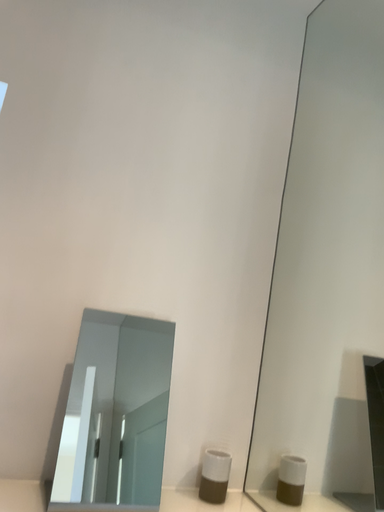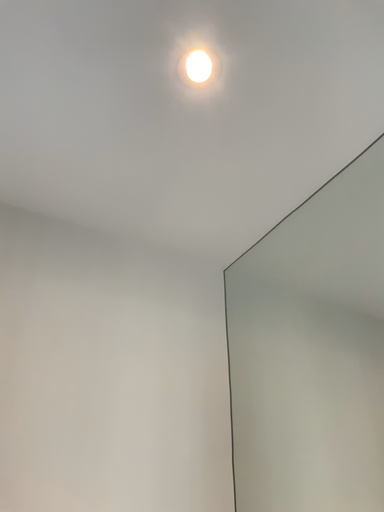
Question: How did the camera likely rotate when shooting the video?

Choices:
 (A) rotated left
 (B) rotated right

Answer: (B)